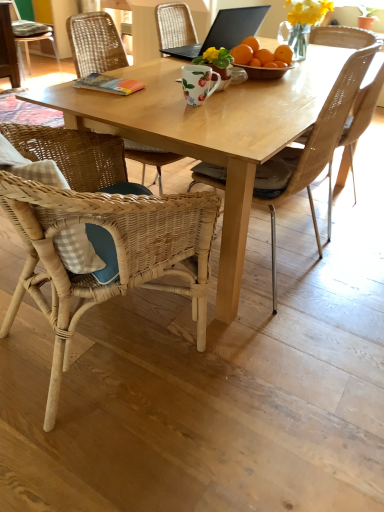
Locate an element on the screen. Image resolution: width=384 pixels, height=512 pixels. vacant space to the right of woven wood chair at center, which appears as the 3th chair when viewed from the back is located at coordinates (342, 276).